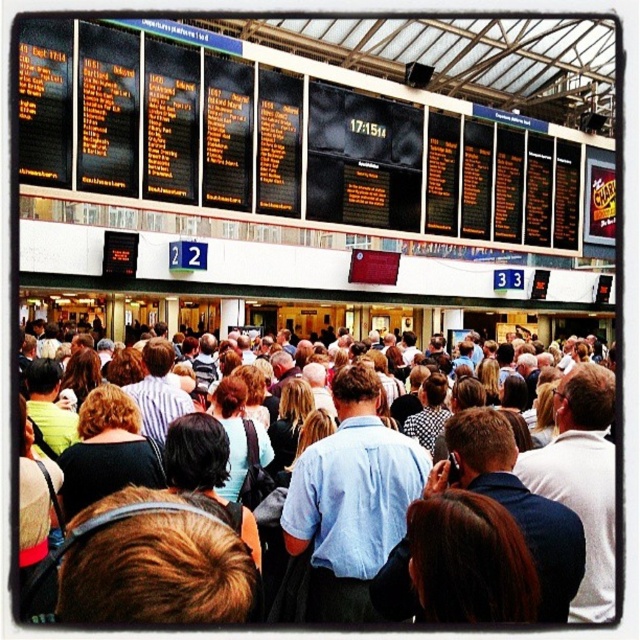
You are standing in the train station and need to locate the black digital display at upper center. According to the scene description, where should you look relative to the departure board?

The black digital display at upper center is located at the upper center of the scene, which is at the top of the frame where the large digital departure board is situated. Since its 2D coordinates are at point [330,122], it is positioned slightly to the left and just below the very top of the departure board.

You are standing in the train station and want to locate two specific points marked on the departure board. The first point is at coordinates point [275,106] and the second is at point [547,572]. Which point is closer to you?

Point [275,106] is closer to you because it is further to the viewer than point [547,572].